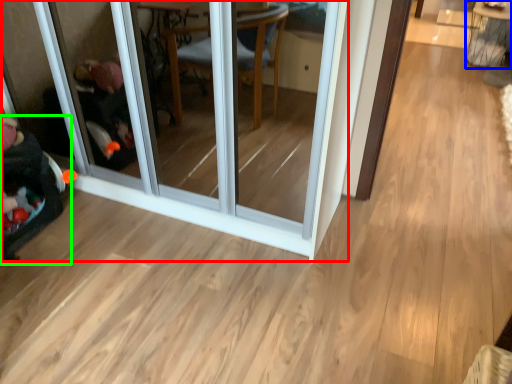
Question: Estimate the real-world distances between objects in this image. Which object is closer to screen door (highlighted by a red box), table (highlighted by a blue box) or baby carriage (highlighted by a green box)?

Choices:
 (A) table
 (B) baby carriage

Answer: (B)